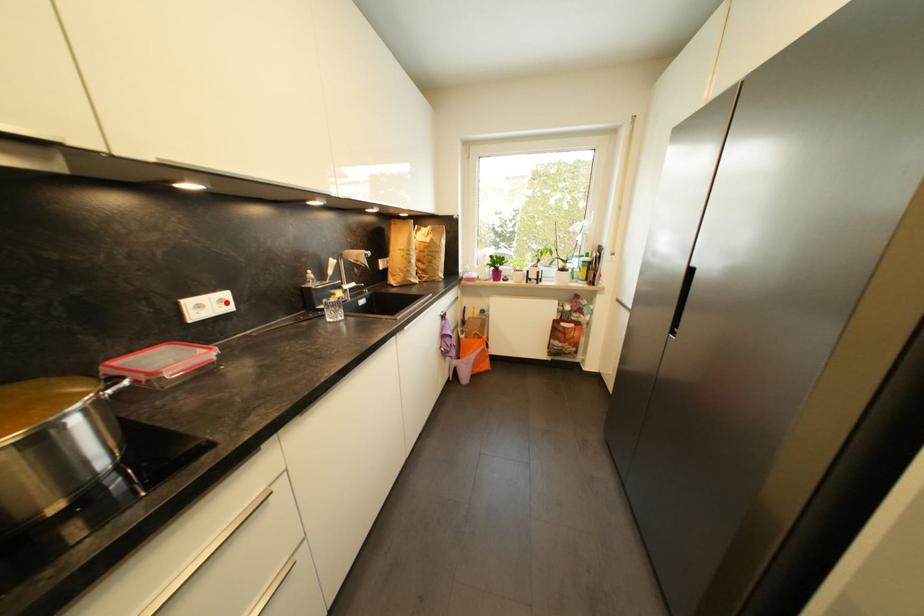
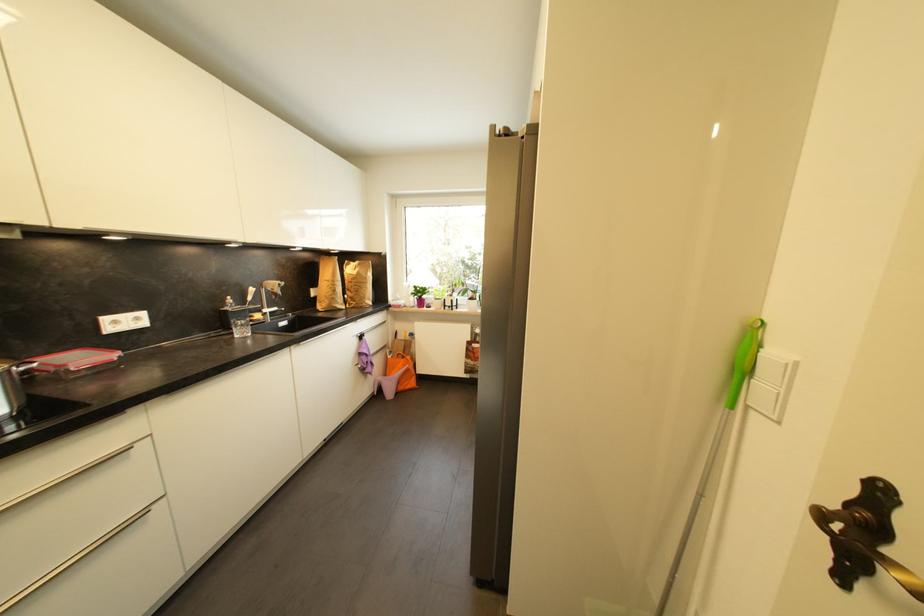
Find the pixel in the second image that matches the highlighted location in the first image.

(142, 321)